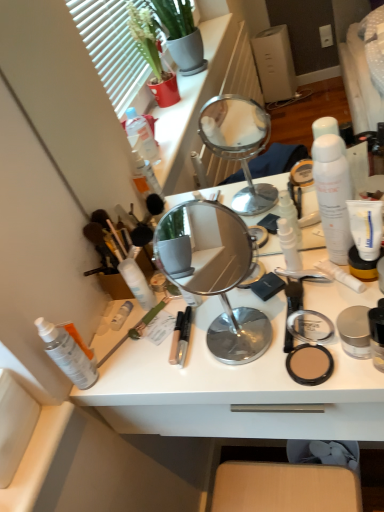
Locate an element on the screen. The width and height of the screenshot is (384, 512). vacant space that's between white matte lotion at center, which is counted as the 3th toiletry, starting from the left, and white matte tube at right, acting as the first toothpaste starting from the top is located at coordinates (226, 301).